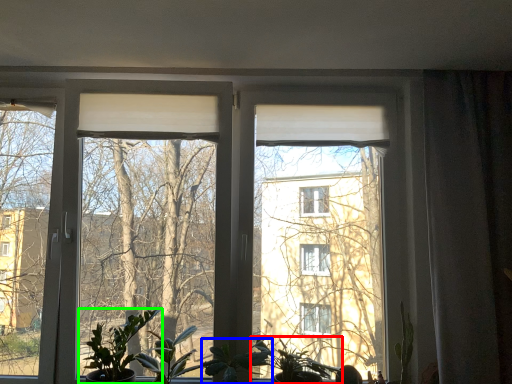
Question: Considering the real-world distances, which object is closest to houseplant (highlighted by a red box)? plant (highlighted by a blue box) or houseplant (highlighted by a green box).

Choices:
 (A) plant
 (B) houseplant

Answer: (A)